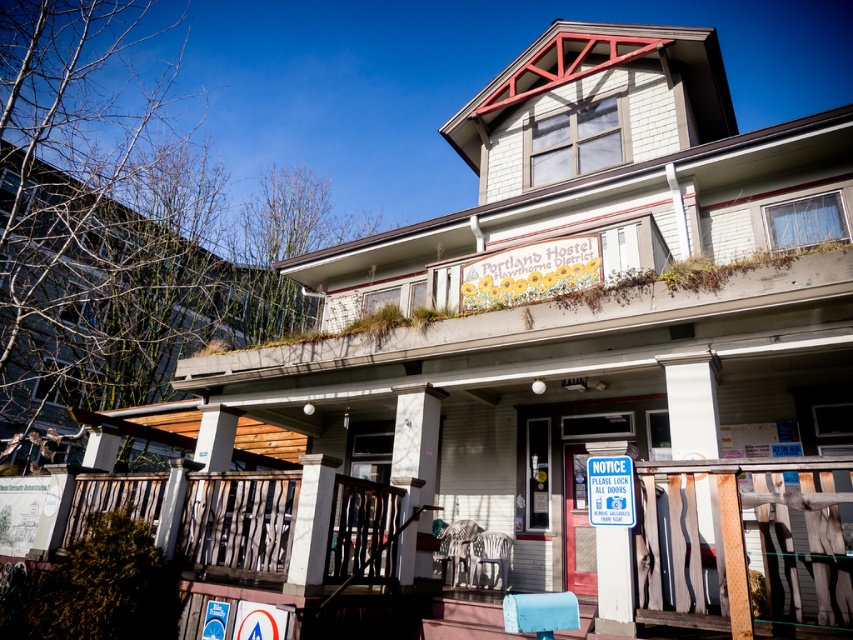
You are standing at the entrance of Portland Hostel and want to place a 20 inch wide decorative item between the wooden at lower right and the blue plastic sign at center. Is there enough space?

The wooden at lower right is 24.00 inches from the blue plastic sign at center, so yes, there is enough space to place a 20 inch wide decorative item between them.

You are a visitor approaching the Portland Hostel and notice the wooden at lower right and the blue plastic sign at center. Which object is positioned lower in the image?

The wooden at lower right is located below the blue plastic sign at center, so the wooden at lower right is positioned lower in the image.